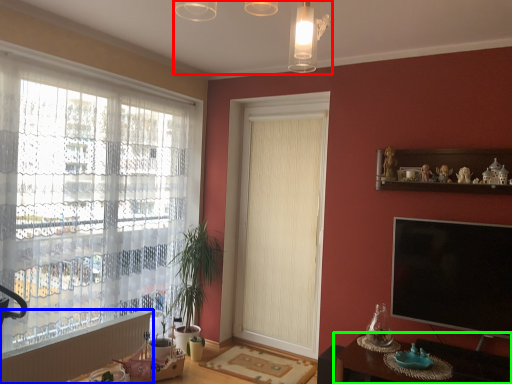
Question: Which is farther away from light fixture (highlighted by a red box)? radiator (highlighted by a blue box) or table (highlighted by a green box)?

Choices:
 (A) radiator
 (B) table

Answer: (A)